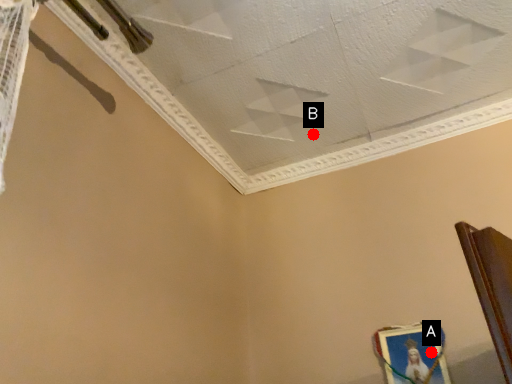
Question: Two points are circled on the image, labeled by A and B beside each circle. Which point appears closest to the camera in this image?

Choices:
 (A) A is closer
 (B) B is closer

Answer: (A)